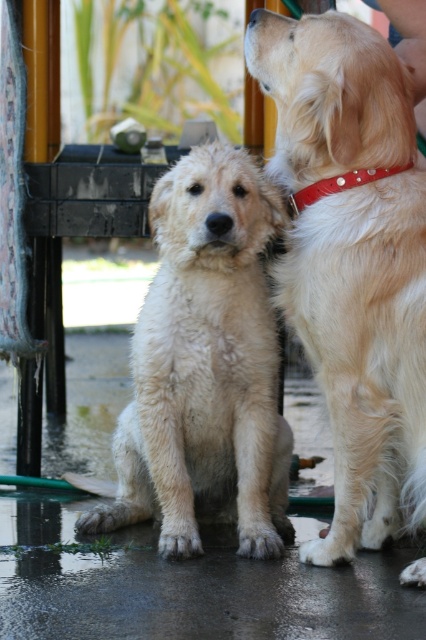
You are standing at the center of the image and want to locate the shiny golden fur at right. Which direction should you look relative to the point marked at coordinates point (365, 349)?

The shiny golden fur at right is located to the right of the point marked at coordinates point (365, 349).

You are a photographer trying to capture a closeup of the shiny golden fur at right and the red leather collar at upper right. Which object should you focus on first if you want to ensure both are in focus without moving the camera?

The shiny golden fur at right is located below the red leather collar at upper right. Since they are at different vertical positions, you should focus on the shiny golden fur at right first as it is closer to the camera, ensuring both will be in focus with proper depth of field.

You are a photographer trying to capture both the shiny golden fur at right and the fuzzy white dog at center in focus. Since you can only focus on one subject at a time, which dog should you focus on to ensure the other appears blurry?

You should focus on the shiny golden fur at right because it is in front of the fuzzy white dog at center, so the background subject will be blurry.